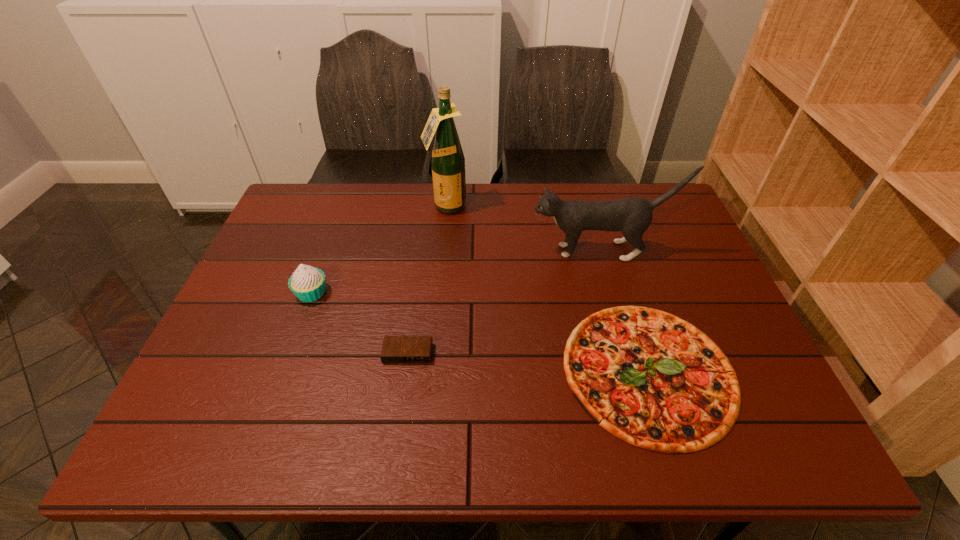
Identify the location of vacant space that is in between the liquor and the second shortest object. (427, 280).

What are the coordinates of `free spot between the alarm clock and the pizza` in the screenshot? It's located at (528, 362).

Where is `vacant point located between the fourth tallest object and the liquor`? vacant point located between the fourth tallest object and the liquor is located at coordinates (427, 280).

Where is `vacant region between the cupcake and the cat`? The height and width of the screenshot is (540, 960). vacant region between the cupcake and the cat is located at coordinates (456, 272).

The height and width of the screenshot is (540, 960). Identify the location of free space between the third shortest object and the cat. (456, 272).

Where is `empty space that is in between the pizza and the leftmost object`? empty space that is in between the pizza and the leftmost object is located at coordinates (480, 332).

Where is `empty space between the alarm clock and the pizza`? empty space between the alarm clock and the pizza is located at coordinates (528, 362).

Where is `free space between the fourth nearest object and the third tallest object`? Image resolution: width=960 pixels, height=540 pixels. free space between the fourth nearest object and the third tallest object is located at coordinates (456, 272).

The width and height of the screenshot is (960, 540). I want to click on object that is the fourth nearest to the fourth nearest object, so tap(308, 284).

Locate which object is the fourth closest to the third nearest object. Please provide its 2D coordinates. Your answer should be formatted as a tuple, i.e. [(x, y)], where the tuple contains the x and y coordinates of a point satisfying the conditions above.

[(650, 378)]